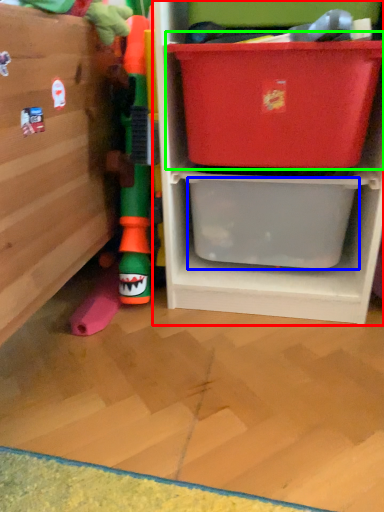
Question: Which object is the farthest from shelf (highlighted by a red box)? Choose among these: storage box (highlighted by a blue box) or storage box (highlighted by a green box).

Choices:
 (A) storage box
 (B) storage box

Answer: (B)